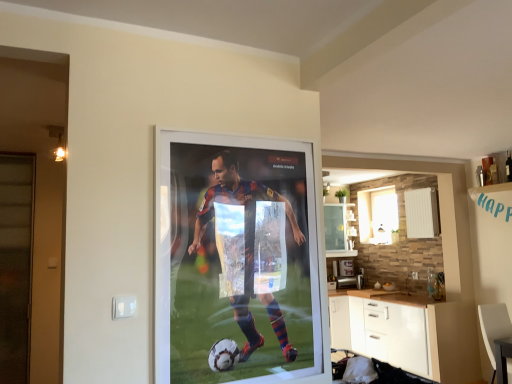
Question: From a real-world perspective, is white matte cabinet at lower right on top of white leather armchair at lower right?

Choices:
 (A) yes
 (B) no

Answer: (B)

Question: Is white matte cabinet at lower right behind white leather armchair at lower right?

Choices:
 (A) yes
 (B) no

Answer: (A)

Question: Is white leather armchair at lower right surrounded by white matte cabinet at lower right?

Choices:
 (A) yes
 (B) no

Answer: (B)

Question: Is white matte cabinet at lower right closer to the viewer compared to white leather armchair at lower right?

Choices:
 (A) no
 (B) yes

Answer: (A)

Question: Does white matte cabinet at lower right appear on the right side of white leather armchair at lower right?

Choices:
 (A) no
 (B) yes

Answer: (A)

Question: Does white matte cabinet at lower right have a greater height compared to white leather armchair at lower right?

Choices:
 (A) yes
 (B) no

Answer: (A)

Question: From a real-world perspective, is white leather armchair at lower right physically below translucent glass screen door at left?

Choices:
 (A) yes
 (B) no

Answer: (A)

Question: Is white leather armchair at lower right far away from translucent glass screen door at left?

Choices:
 (A) no
 (B) yes

Answer: (B)

Question: Is white leather armchair at lower right thinner than translucent glass screen door at left?

Choices:
 (A) no
 (B) yes

Answer: (A)

Question: From the image's perspective, is white leather armchair at lower right under translucent glass screen door at left?

Choices:
 (A) no
 (B) yes

Answer: (B)

Question: Does white leather armchair at lower right contain translucent glass screen door at left?

Choices:
 (A) yes
 (B) no

Answer: (B)

Question: Considering the relative sizes of white leather armchair at lower right and translucent glass screen door at left in the image provided, is white leather armchair at lower right taller than translucent glass screen door at left?

Choices:
 (A) yes
 (B) no

Answer: (B)

Question: Is white frosted glass window at upper right bigger than translucent glass screen door at left?

Choices:
 (A) yes
 (B) no

Answer: (B)